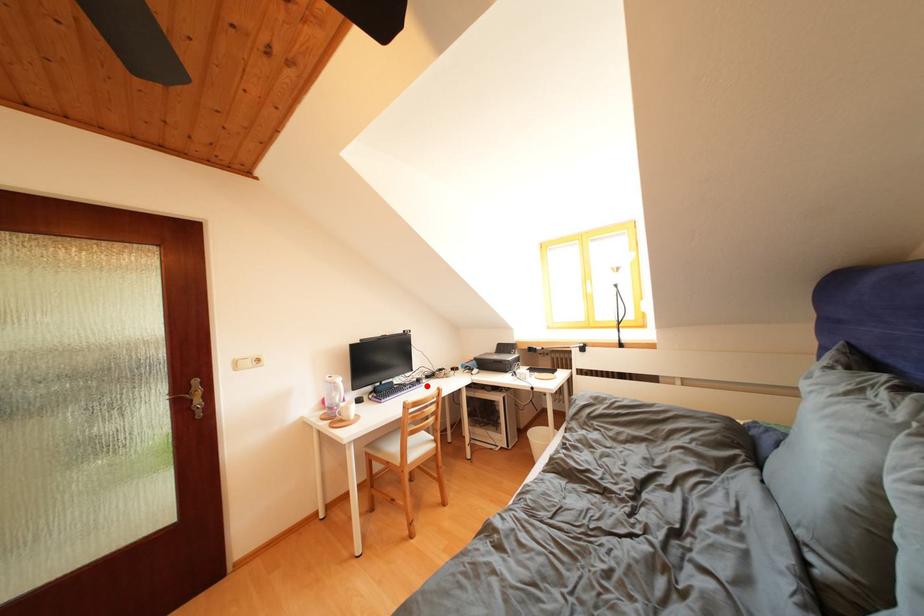
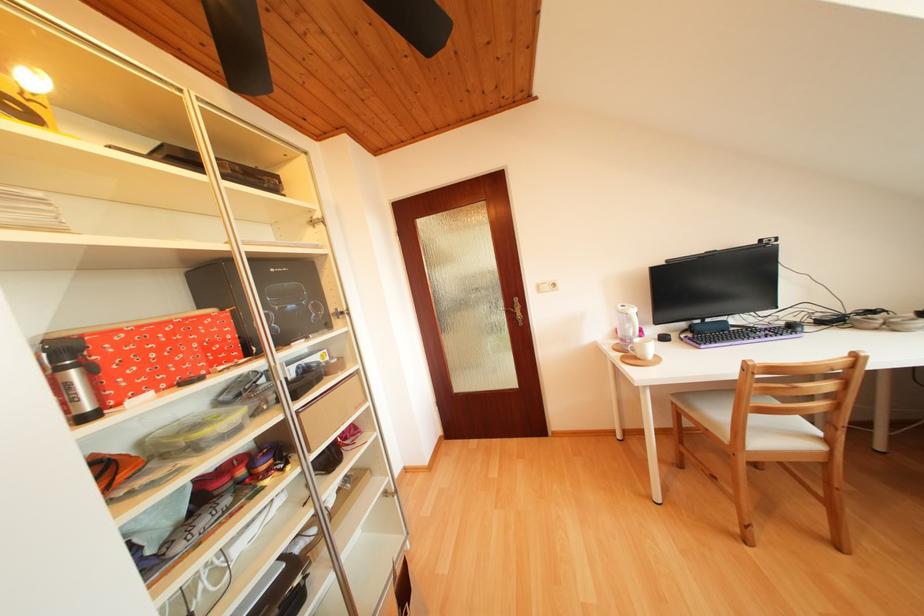
The point at the highlighted location is marked in the first image. Where is the corresponding point in the second image?

(799, 331)